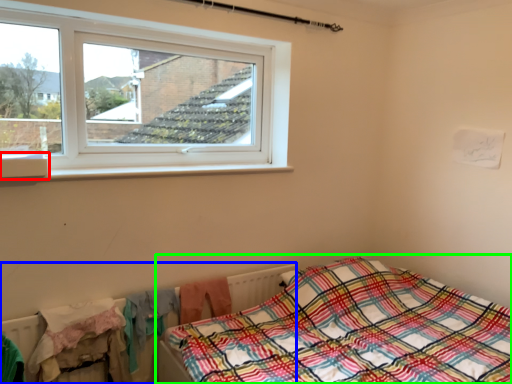
Question: Which object is positioned farthest from window sill (highlighted by a red box)? Select from radiator (highlighted by a blue box) and bed (highlighted by a green box).

Choices:
 (A) radiator
 (B) bed

Answer: (B)